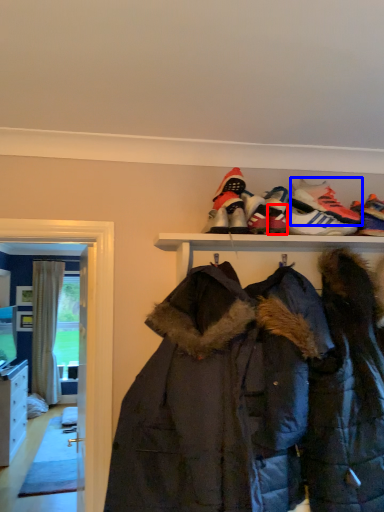
Question: Among these objects, which one is farthest to the camera, shoe (highlighted by a red box) or footwear (highlighted by a blue box)?

Choices:
 (A) shoe
 (B) footwear

Answer: (B)